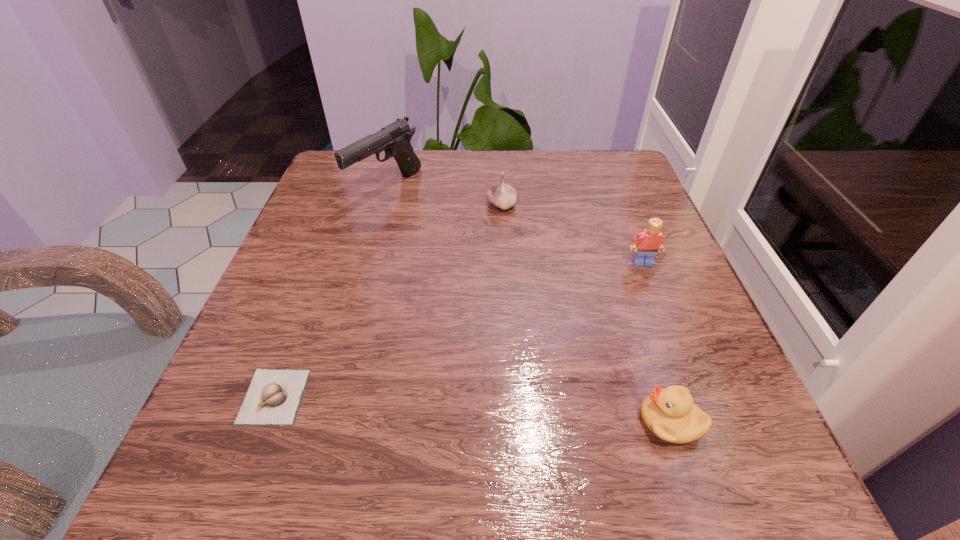
This screenshot has width=960, height=540. I want to click on Lego at the right edge, so click(x=649, y=241).

Locate an element on the screen. duckling that is at the right edge is located at coordinates (670, 414).

Find the location of a particular element. object situated at the far left corner is located at coordinates (394, 139).

I want to click on object that is at the near right corner, so coord(670,414).

Identify the location of vacant space at the far edge of the desktop. This screenshot has height=540, width=960. (443, 180).

Locate an element on the screen. The image size is (960, 540). free space at the near edge of the desktop is located at coordinates (397, 490).

Find the location of a particular element. Image resolution: width=960 pixels, height=540 pixels. free point at the left edge is located at coordinates (366, 243).

In the image, there is a desktop. At what (x,y) coordinates should I click in order to perform the action: click on vacant space at the right edge. Please return your answer as a coordinate pair (x, y). Looking at the image, I should click on (617, 232).

Identify the location of vacant space at the near left corner of the desktop. The height and width of the screenshot is (540, 960). (257, 447).

The width and height of the screenshot is (960, 540). I want to click on vacant region at the far right corner of the desktop, so click(x=626, y=178).